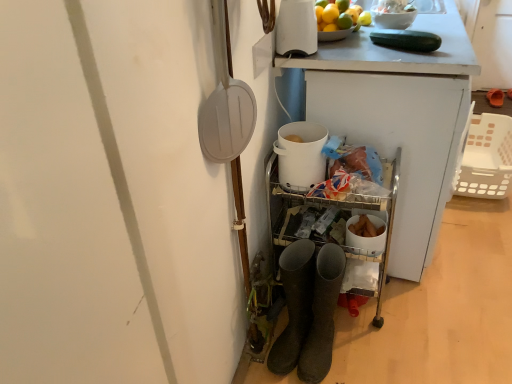
Question: From a real-world perspective, is white plastic basket at right above or below white matte bucket at center, which is the 2th appliance from top to bottom?

Choices:
 (A) above
 (B) below

Answer: (B)

Question: Is point (499, 178) positioned closer to the camera than point (282, 137)?

Choices:
 (A) closer
 (B) farther

Answer: (B)

Question: Which object is positioned farthest from the dark brown suede boots at lower center, which ranks as the 1th footwear in bottom-to-top order?

Choices:
 (A) white plastic basket at right
 (B) white plastic shovel at upper left
 (C) green matte cucumber at upper right
 (D) orange rubber boots at lower right, placed as the second footwear when sorted from bottom to top
 (E) white glossy bowl at upper right

Answer: (D)

Question: Considering the real-world distances, which object is farthest from the white plastic basket at right?

Choices:
 (A) white glossy kettle at upper center, which ranks as the second appliance in bottom-to-top order
 (B) white plastic shovel at upper left
 (C) green matte cucumber at upper right
 (D) dark brown suede boots at lower center, positioned as the second footwear in top-to-bottom order
 (E) orange rubber boots at lower right, positioned as the first footwear in top-to-bottom order

Answer: (B)